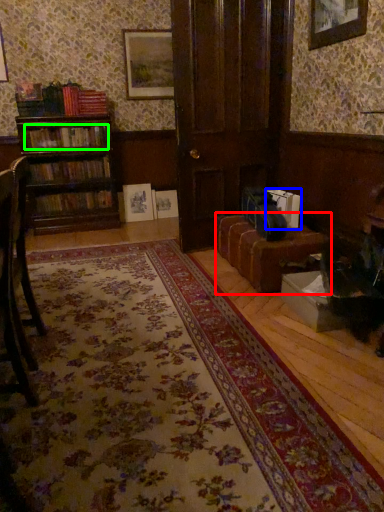
Question: Which is farther away from table (highlighted by a red box)? book (highlighted by a blue box) or book (highlighted by a green box)?

Choices:
 (A) book
 (B) book

Answer: (B)